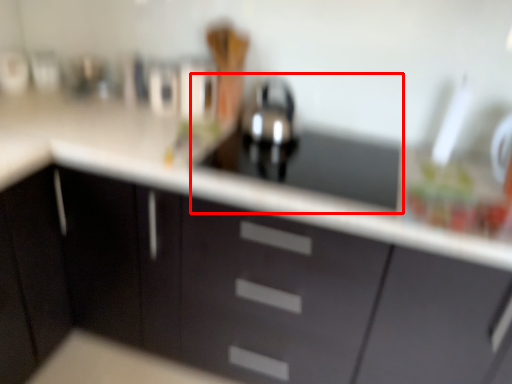
Question: Observing the image, what is the correct spatial positioning of sink (annotated by the red box) in reference to cabinetry?

Choices:
 (A) left
 (B) right

Answer: (B)